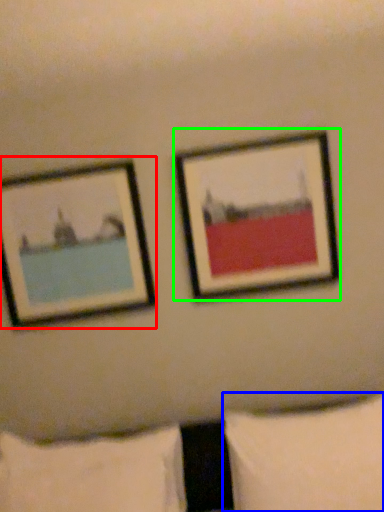
Question: Considering the real-world distances, which object is farthest from picture frame (highlighted by a red box)? pillow (highlighted by a blue box) or picture frame (highlighted by a green box)?

Choices:
 (A) pillow
 (B) picture frame

Answer: (A)